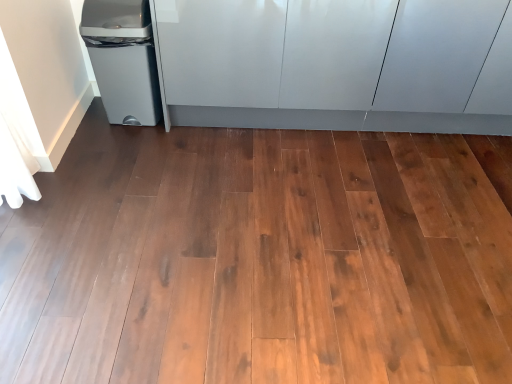
This screenshot has height=384, width=512. In order to click on free area in between white fabric curtain at left and matte gray plastic trash can at left in this screenshot , I will do tap(91, 155).